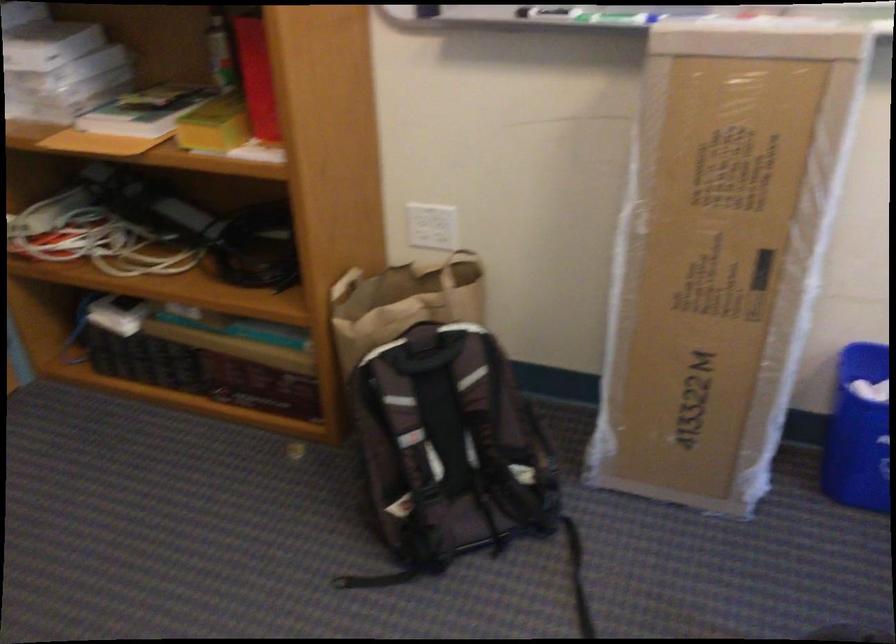
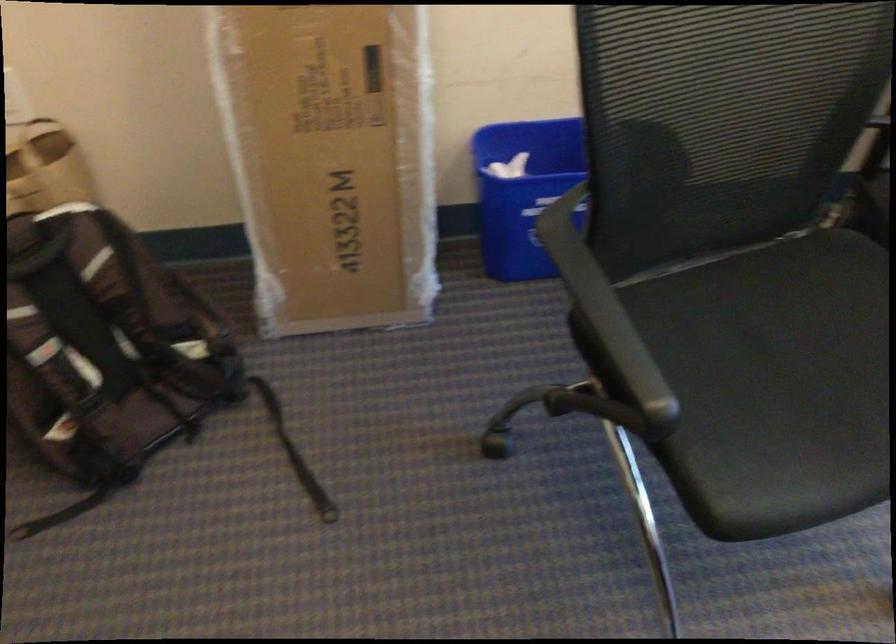
Consider the image. In a continuous first-person perspective shot, in which direction is the camera moving?

The movement direction of the cameraman is right, forward.